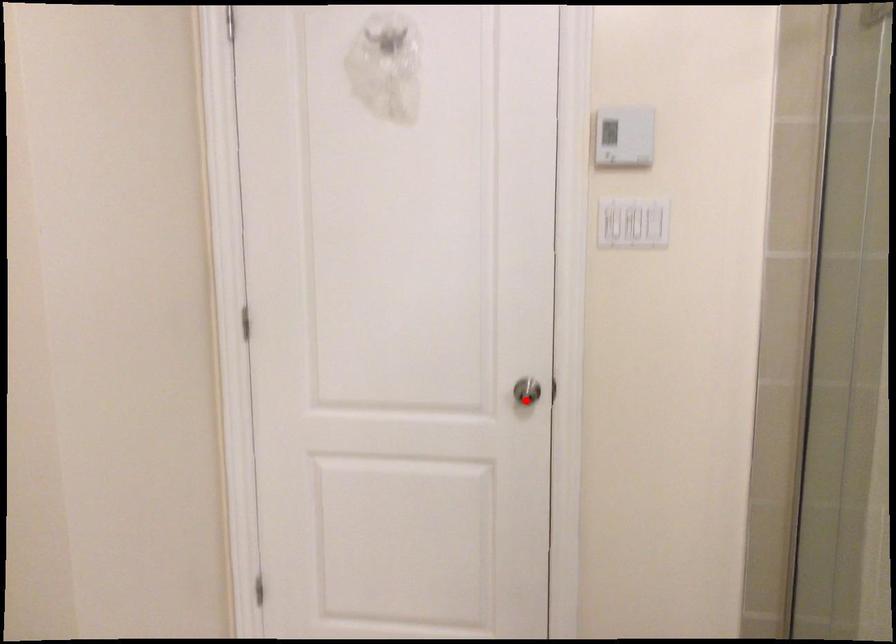
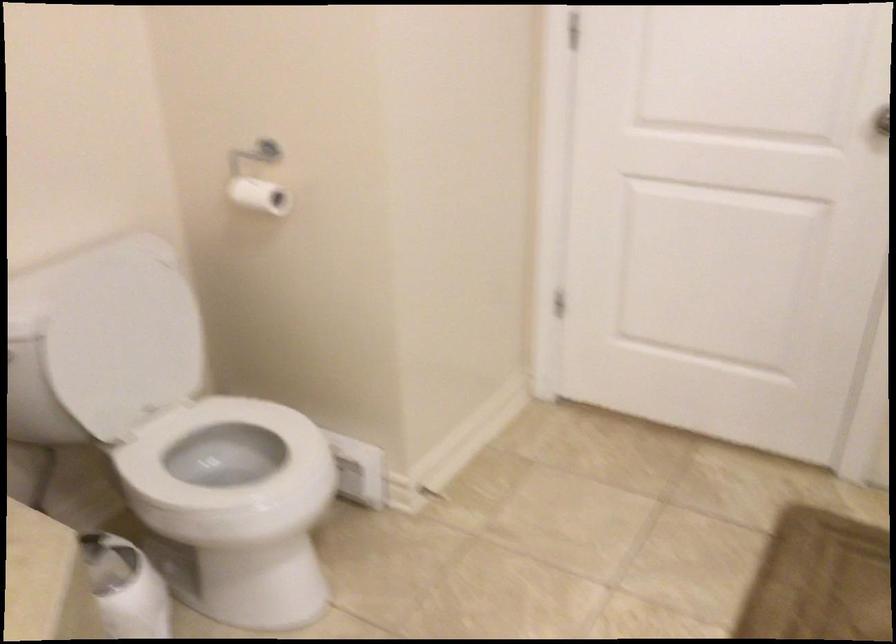
In the second image, find the point that corresponds to the highlighted location in the first image.

(879, 131)